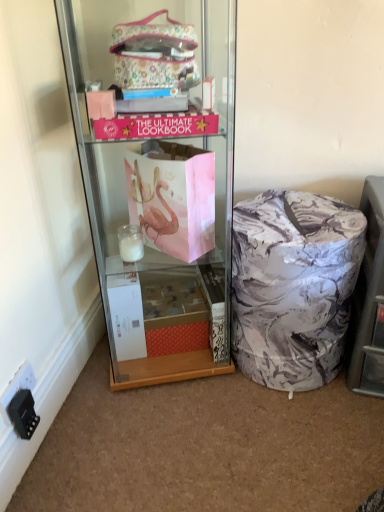
Where is `vacant space that's between matte pink paper bag at center and marble-patterned laundry basket at lower right`? The height and width of the screenshot is (512, 384). vacant space that's between matte pink paper bag at center and marble-patterned laundry basket at lower right is located at coordinates (219, 396).